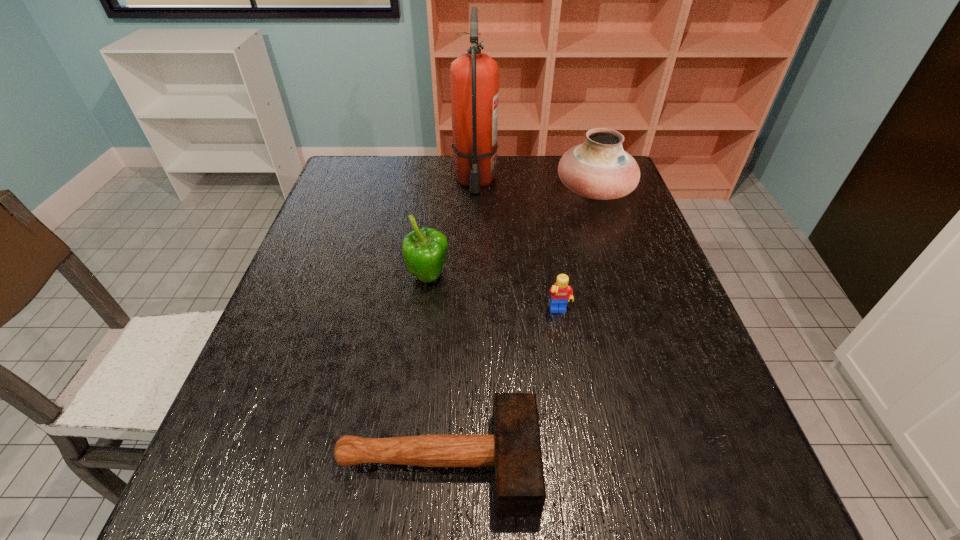
You are a GUI agent. You are given a task and a screenshot of the screen. Output one action in this format:
    pyautogui.click(x=<x>, y=<y>)
    Task: Click on the free point located 0.210m on the face of the Lego
    
    Given the screenshot: What is the action you would take?
    pyautogui.click(x=575, y=406)

Locate an element on the screen. The height and width of the screenshot is (540, 960). vacant space located on the hammer head face of the mallet is located at coordinates (572, 461).

Locate an element on the screen. This screenshot has width=960, height=540. fire extinguisher located in the far edge section of the desktop is located at coordinates (474, 76).

Locate an element on the screen. pottery at the far edge is located at coordinates (599, 168).

Where is `object located at the near edge`? This screenshot has height=540, width=960. object located at the near edge is located at coordinates (514, 449).

You are a GUI agent. You are given a task and a screenshot of the screen. Output one action in this format:
    pyautogui.click(x=<x>, y=<y>)
    Task: Click on the object at the right edge
    
    Given the screenshot: What is the action you would take?
    pyautogui.click(x=599, y=168)

The width and height of the screenshot is (960, 540). In order to click on object that is at the far right corner in this screenshot , I will do `click(599, 168)`.

This screenshot has height=540, width=960. Find the location of `free space at the far edge`. free space at the far edge is located at coordinates (480, 189).

This screenshot has width=960, height=540. In the image, there is a desktop. In order to click on vacant space at the left edge in this screenshot , I will do `click(311, 420)`.

Where is `vacant space at the right edge of the desktop`? vacant space at the right edge of the desktop is located at coordinates (667, 326).